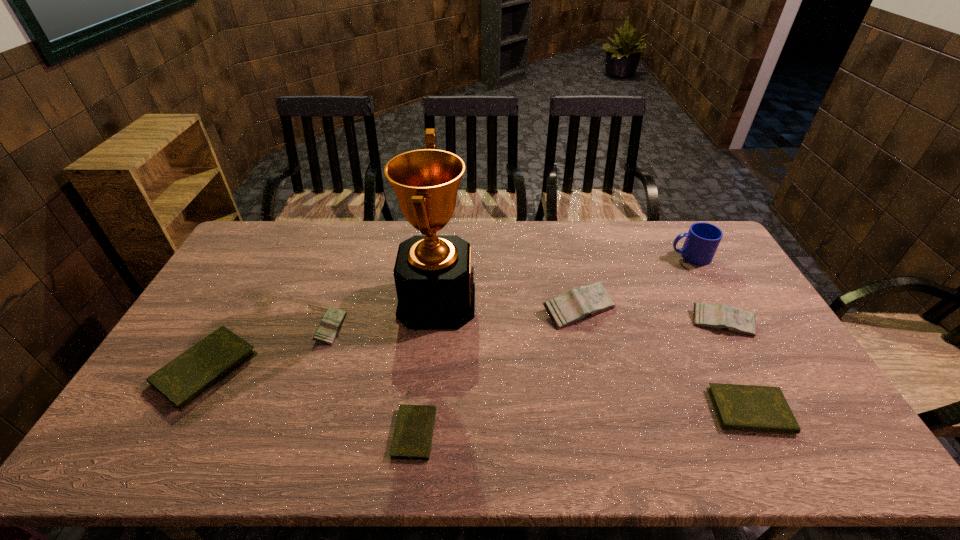
Identify which green diary is located as the third nearest to the second smallest pink diary. Please provide its 2D coordinates. Your answer should be formatted as a tuple, i.e. [(x, y)], where the tuple contains the x and y coordinates of a point satisfying the conditions above.

[(185, 379)]

Identify which green diary is located as the third nearest to the seventh shortest object. Please provide its 2D coordinates. Your answer should be formatted as a tuple, i.e. [(x, y)], where the tuple contains the x and y coordinates of a point satisfying the conditions above.

[(185, 379)]

I want to click on vacant area that satisfies the following two spatial constraints: 1. on the back side of the fourth diary from left to right; 2. on the left side of the smallest green diary, so click(x=429, y=309).

The image size is (960, 540). I want to click on free region that satisfies the following two spatial constraints: 1. on the front of the fifth shortest object with the label; 2. on the left side of the gold trophy cup, so click(435, 322).

Find the location of `free location that satisfies the following two spatial constraints: 1. on the back side of the second tallest diary; 2. on the left side of the leftmost green diary`. free location that satisfies the following two spatial constraints: 1. on the back side of the second tallest diary; 2. on the left side of the leftmost green diary is located at coordinates (231, 322).

At what (x,y) coordinates should I click in order to perform the action: click on vacant point that satisfies the following two spatial constraints: 1. on the front of the tallest object with the label; 2. on the back side of the seventh tallest object. Please return your answer as a coordinate pair (x, y). Image resolution: width=960 pixels, height=540 pixels. Looking at the image, I should click on (425, 411).